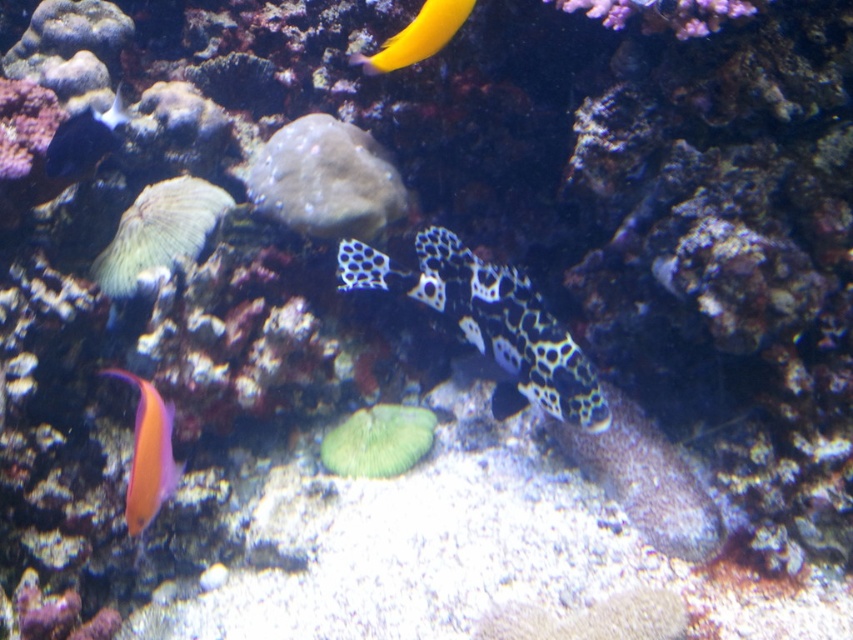
Who is lower down, green coral at center or shiny orange fish at lower left?

shiny orange fish at lower left

Is green coral at center wider than shiny orange fish at lower left?

Correct, the width of green coral at center exceeds that of shiny orange fish at lower left.

Who is more forward, (190, 182) or (158, 440)?

Point (158, 440) is more forward.

Where is `green coral at center`? The image size is (853, 640). green coral at center is located at coordinates (160, 230).

Who is higher up, shiny yellow fish at upper center or shiny black fish at upper left?

shiny yellow fish at upper center is higher up.

Who is taller, shiny yellow fish at upper center or shiny black fish at upper left?

With more height is shiny black fish at upper left.

Which is in front, point (381, 54) or point (80, 138)?

Point (381, 54)

You are a GUI agent. You are given a task and a screenshot of the screen. Output one action in this format:
    pyautogui.click(x=<x>, y=<y>)
    Task: Click on the shiny yellow fish at upper center
    Image resolution: width=853 pixels, height=640 pixels.
    Given the screenshot: What is the action you would take?
    pyautogui.click(x=416, y=36)

Between point (389, 257) and point (114, 108), which one is positioned in front?

Positioned in front is point (389, 257).

Does black and white spotted fish at center have a greater width compared to shiny black fish at upper left?

Yes, black and white spotted fish at center is wider than shiny black fish at upper left.

Does point (439, 260) come farther from viewer compared to point (86, 141)?

That is False.

The height and width of the screenshot is (640, 853). In order to click on black and white spotted fish at center in this screenshot , I will do `click(489, 323)`.